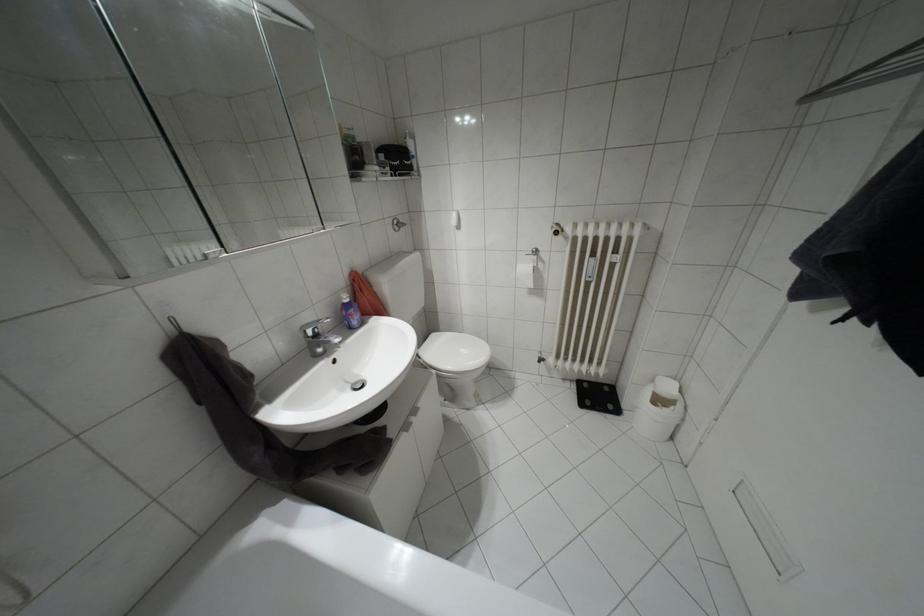
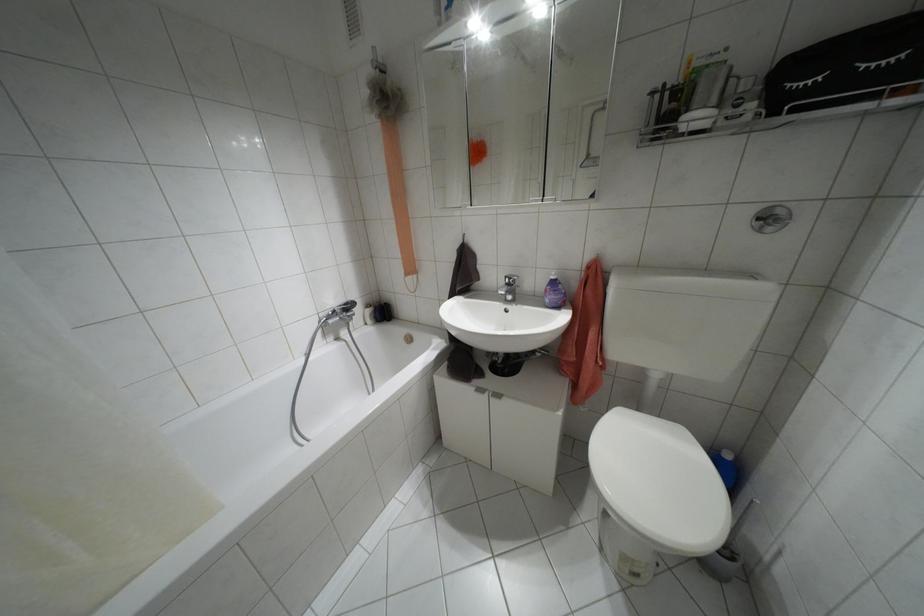
Where in the second image is the point corresponding to point 395,175 from the first image?

(773, 113)